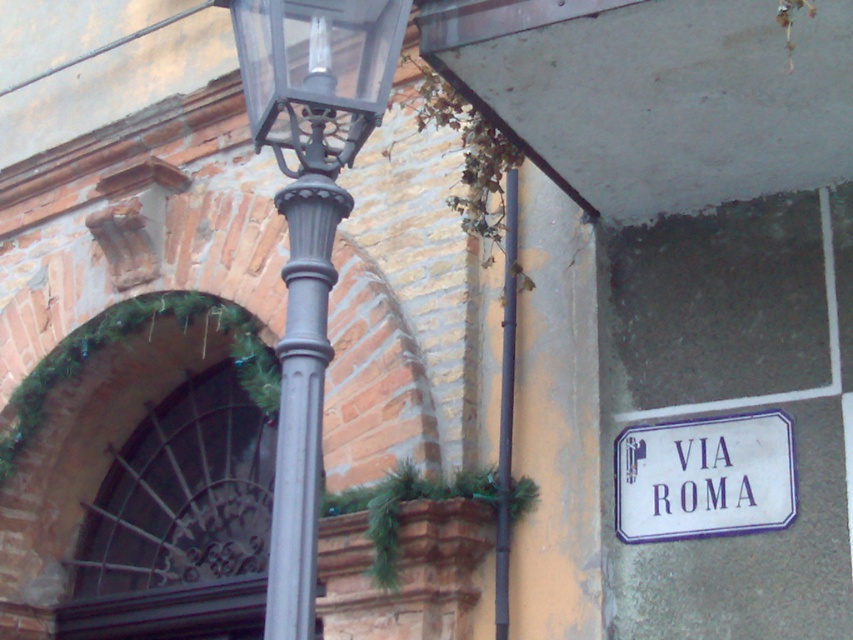
You are a city planner analyzing the street layout. You need to determine if the matte black street light at center can be replaced with a wider model without exceeding the width of the white plastic street sign at lower right. Can it?

The matte black street light at center is narrower than the white plastic street sign at lower right, so replacing it with a wider model that matches the sign width would be possible as long as the new light doesn not exceed the sign width.

You are a city planner assessing the street layout. You need to ensure that the white plastic street sign at lower right is visible from a distance. Considering the presence of the metallic gray pole at center, which object might block the view of the sign and why?

The metallic gray pole at center might block the view of the white plastic street sign at lower right because it is taller than the sign, potentially obscuring it from certain angles or distances.

You are standing at the street corner shown in the image. There is a point marked at coordinates [300,396]. What object is located at that point?

The point at coordinates [300,396] indicates the metallic gray pole at center.